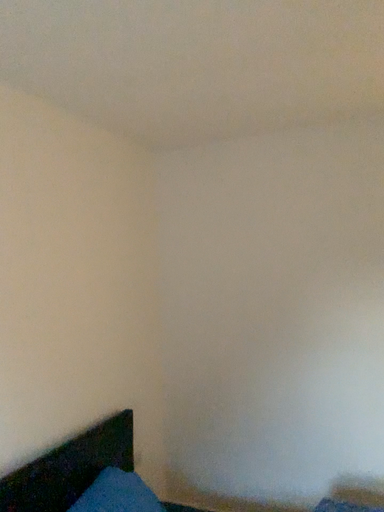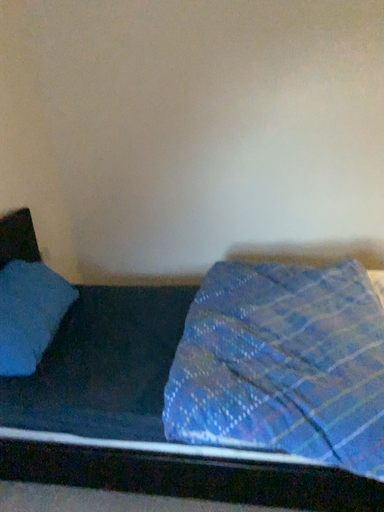
Question: Which way did the camera rotate in the video?

Choices:
 (A) rotated right
 (B) rotated left

Answer: (A)